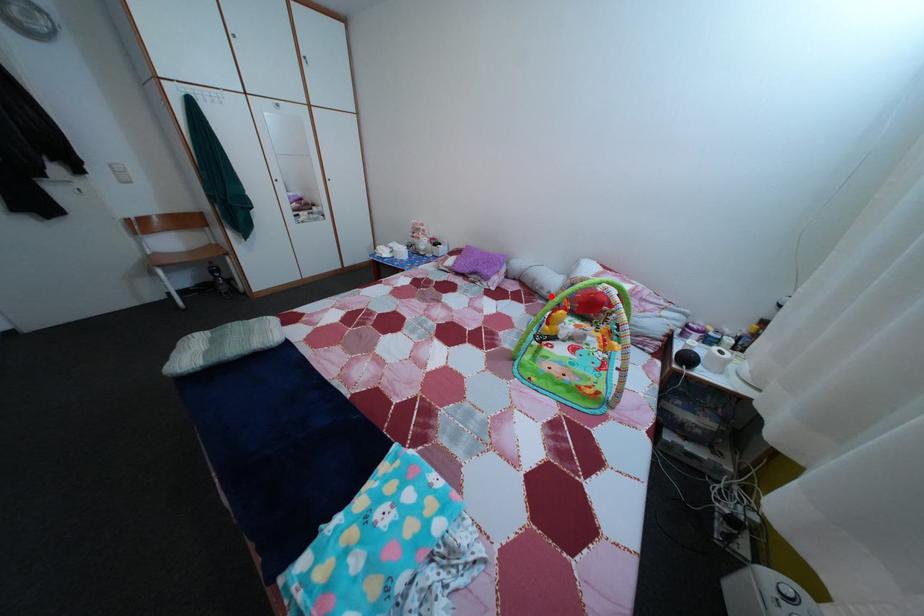
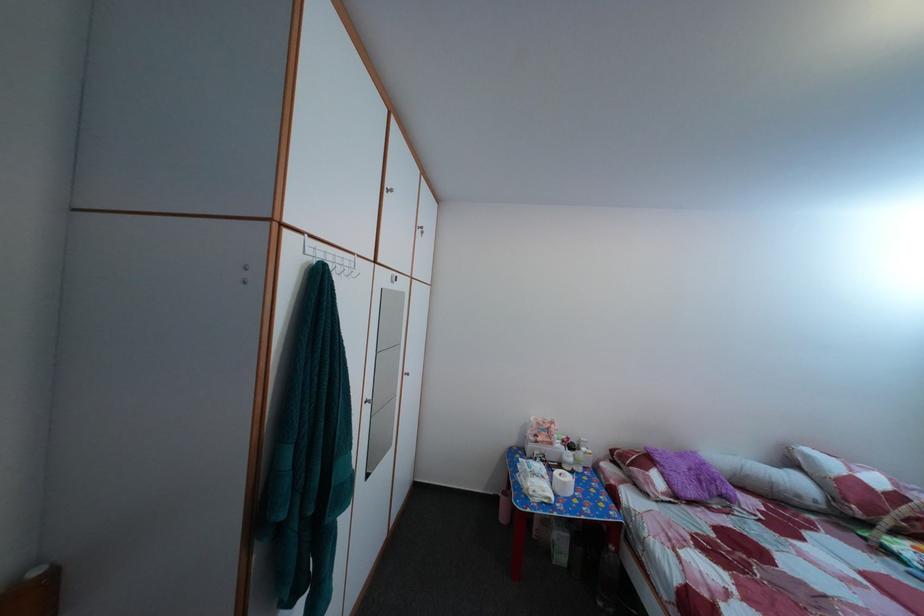
Find the pixel in the second image that matches the highlighted location in the first image.

(808, 504)